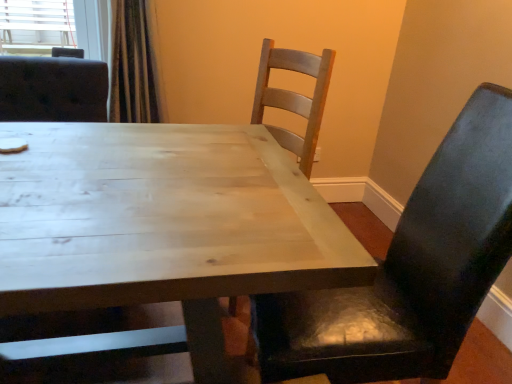
Question: Is light wood table at center to the left of matte black chair at right from the viewer's perspective?

Choices:
 (A) no
 (B) yes

Answer: (B)

Question: Does light wood table at center have a greater width compared to matte black chair at right?

Choices:
 (A) yes
 (B) no

Answer: (A)

Question: Is light wood table at center taller than matte black chair at right?

Choices:
 (A) no
 (B) yes

Answer: (A)

Question: From a real-world perspective, is light wood table at center positioned under matte black chair at right based on gravity?

Choices:
 (A) no
 (B) yes

Answer: (B)

Question: Is light wood table at center aimed at matte black chair at right?

Choices:
 (A) yes
 (B) no

Answer: (B)

Question: Can you confirm if light wood table at center is bigger than matte black chair at right?

Choices:
 (A) no
 (B) yes

Answer: (B)

Question: Considering the relative sizes of matte black chair at right and light wood table at center in the image provided, is matte black chair at right thinner than light wood table at center?

Choices:
 (A) no
 (B) yes

Answer: (B)

Question: Is the position of matte black chair at right less distant than that of light wood table at center?

Choices:
 (A) yes
 (B) no

Answer: (B)

Question: Would you say matte black chair at right is a long distance from light wood table at center?

Choices:
 (A) yes
 (B) no

Answer: (B)

Question: Is matte black chair at right to the left of light wood table at center from the viewer's perspective?

Choices:
 (A) yes
 (B) no

Answer: (B)

Question: Considering the relative positions of matte black chair at right and light wood table at center in the image provided, is matte black chair at right to the right of light wood table at center from the viewer's perspective?

Choices:
 (A) no
 (B) yes

Answer: (B)

Question: Does matte black chair at right touch light wood table at center?

Choices:
 (A) no
 (B) yes

Answer: (A)

Question: From their relative heights in the image, would you say matte black chair at right is taller or shorter than light wood table at center?

Choices:
 (A) short
 (B) tall

Answer: (B)